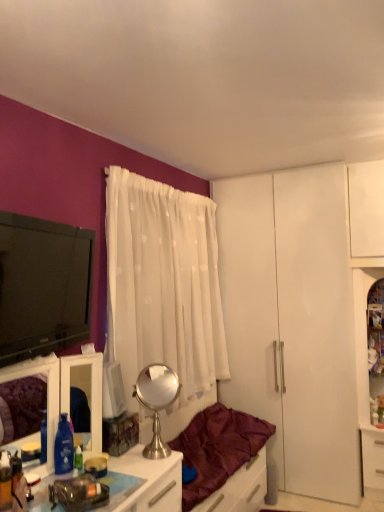
At what (x,y) coordinates should I click in order to perform the action: click on blank space above translucent plastic desk at lower left (from a real-world perspective). Please return your answer as a coordinate pair (x, y). This screenshot has height=512, width=384. Looking at the image, I should click on (69, 481).